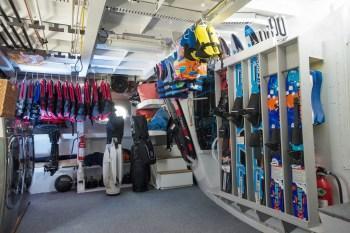
Find the location of a particular element. Image resolution: width=350 pixels, height=233 pixels. stairs is located at coordinates (169, 167), (163, 150).